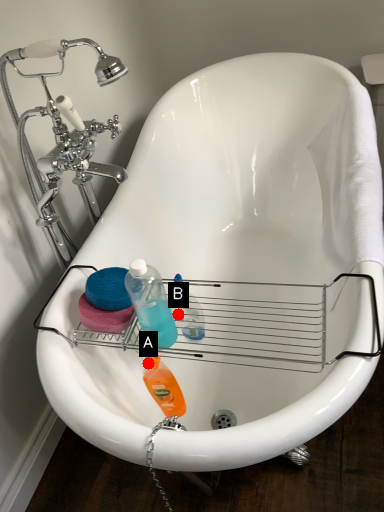
Question: Two points are circled on the image, labeled by A and B beside each circle. Which point is further to the camera?

Choices:
 (A) A is further
 (B) B is further

Answer: (B)